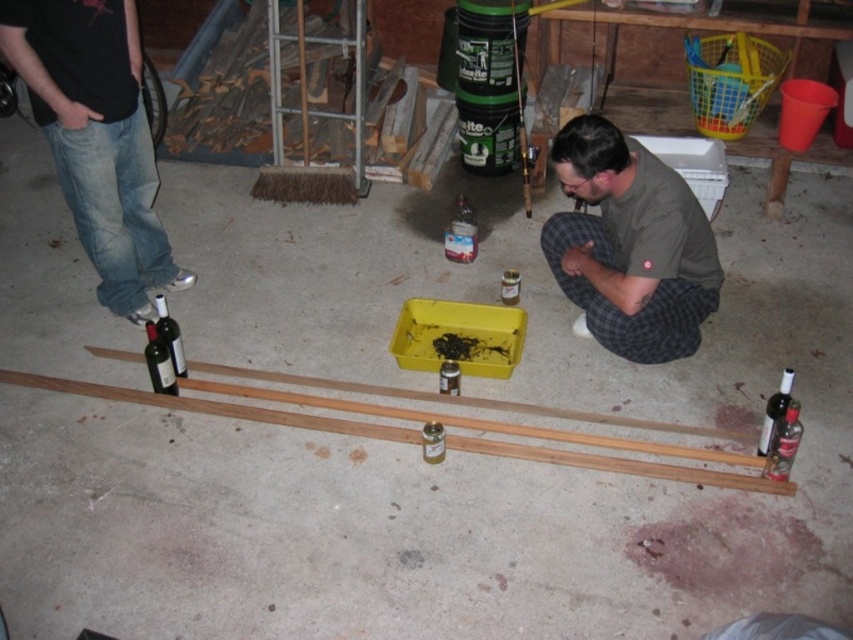
You are standing in the workshop and need to reach both the point at coordinates point [614,308] and the point at coordinates point [148,365]. Which point will you reach first as you move forward?

You will reach the point at coordinates point [614,308] first because it is closer to you than the point at coordinates point [148,365].

You are a delivery person who needs to place a package between the green cotton shirt at lower center and the matte black wine bottle at lower right. The package is 24 inches long. Will it fit in the space between them?

The distance between the green cotton shirt at lower center and the matte black wine bottle at lower right is 23.92 inches. Since the package is 24 inches long, it will not fit in the space between them as the package is slightly longer than the available space.

From the picture: You are a worker in the garage and you need to reach the matte black wine bottle at lower right. Is the green cotton shirt at lower center blocking your path to it?

The green cotton shirt at lower center is above the matte black wine bottle at lower right, so it is not blocking the path to the bottle.